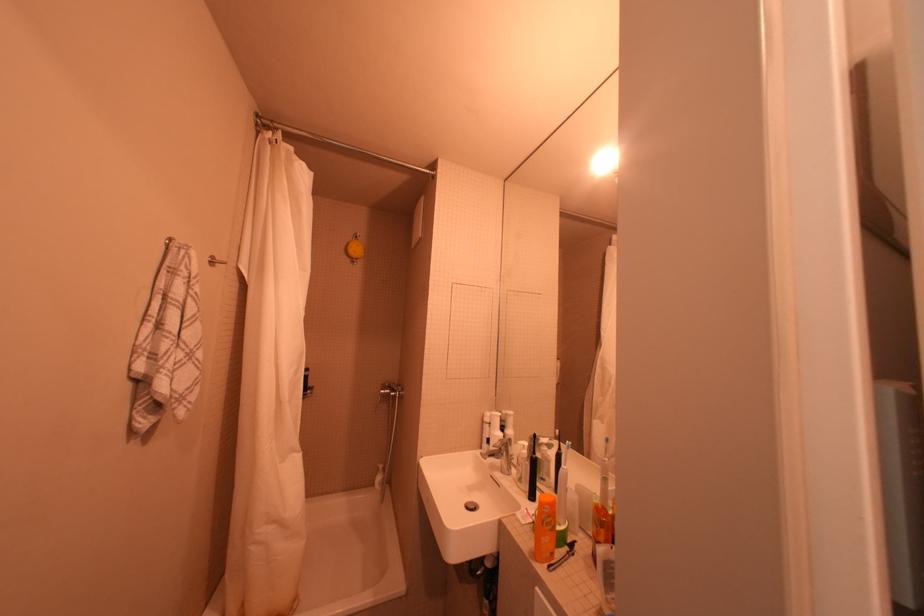
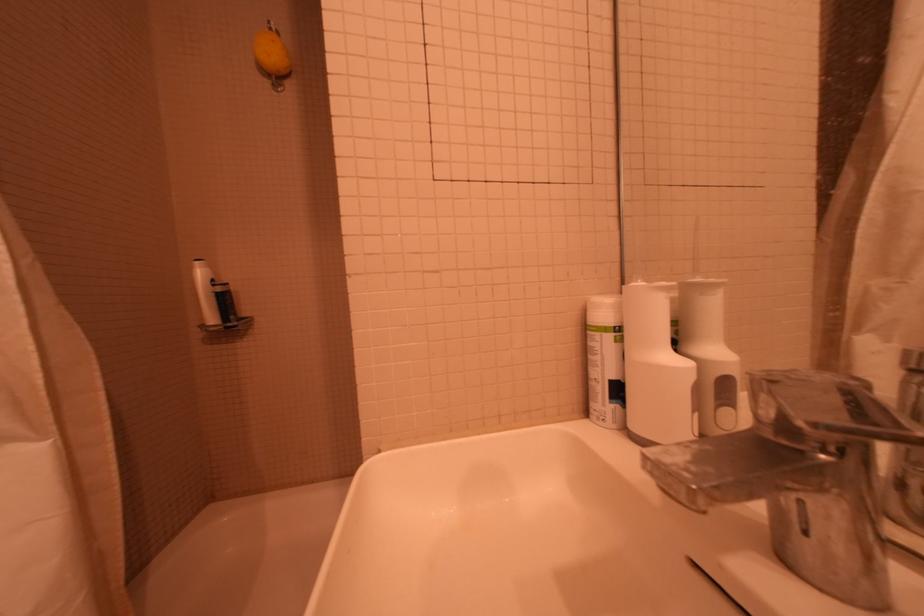
Find the pixel in the second image that matches point (512, 475) in the first image.

(831, 592)